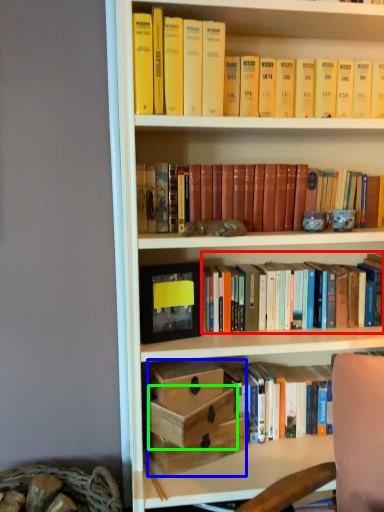
Question: Estimate the real-world distances between objects in this image. Which object is closer to book (highlighted by a red box), box (highlighted by a blue box) or box (highlighted by a green box)?

Choices:
 (A) box
 (B) box

Answer: (A)